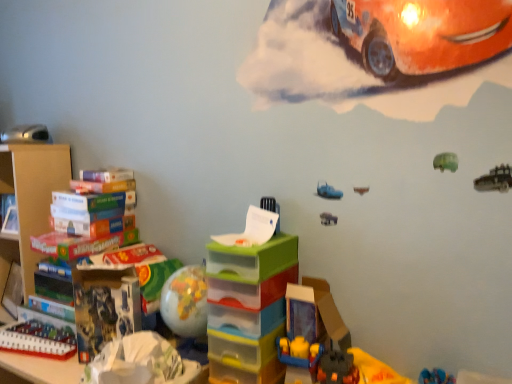
Question: Would you say translucent plastic drawers at center, which is counted as the 2th toy, starting from the right, is to the left or to the right of translucent plastic toy at lower center, placed as the third toy when sorted from bottom to top, in the picture?

Choices:
 (A) right
 (B) left

Answer: (B)

Question: Is translucent plastic drawers at center, the 3th toy from the top, inside or outside of translucent plastic toy at lower center, which appears as the first toy when viewed from the right?

Choices:
 (A) inside
 (B) outside

Answer: (B)

Question: Estimate the real-world distances between objects in this image. Which object is closer to the translucent plastic building blocks at lower left, the first toy from the bottom?

Choices:
 (A) matte black toy car at left, which appears as the fourth toy when viewed from the right
 (B) cardboard at left
 (C) translucent plastic drawers at center, which is the 3th toy in left-to-right order
 (D) translucent plastic toy at lower center, the 2th toy from the top

Answer: (B)

Question: Based on their relative distances, which object is nearer to the matte black toy car at left, the 1th toy positioned from the left?

Choices:
 (A) translucent plastic drawers at center, which is counted as the 2th toy, starting from the right
 (B) translucent plastic building blocks at lower left, the first toy from the bottom
 (C) translucent plastic toy at lower center, the 2th toy from the top
 (D) cardboard at left

Answer: (D)